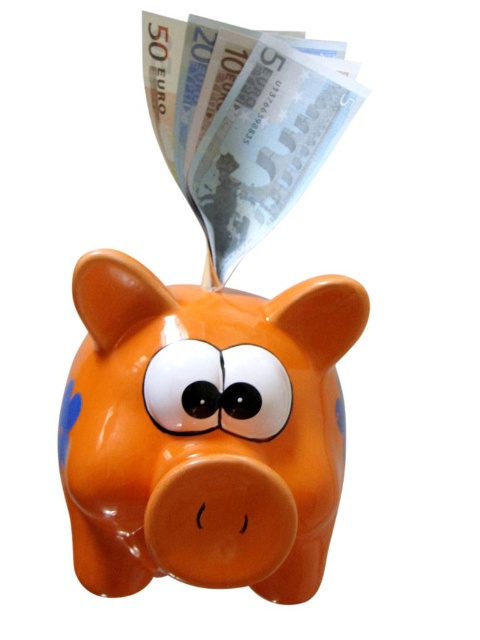
Which is more to the left, glossy ceramic piggy bank at center or silver metallic banknotes at upper center?

glossy ceramic piggy bank at center

Which is in front, point (312, 396) or point (194, 204)?

Point (312, 396) is more forward.

Describe the element at coordinates (204, 429) in the screenshot. I see `glossy ceramic piggy bank at center` at that location.

Find the location of `glossy ceramic piggy bank at center`. glossy ceramic piggy bank at center is located at coordinates point(204,429).